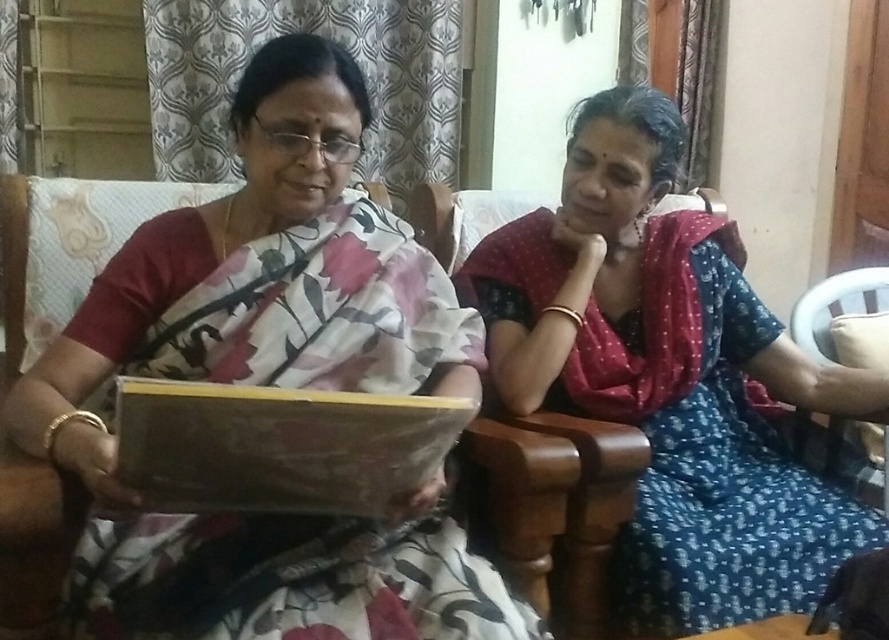
Question: Which point is closer to the camera taking this photo?

Choices:
 (A) (627, 353)
 (B) (223, 211)

Answer: (B)

Question: Can you confirm if floral silk saree at center is positioned below blue printed saree at center?

Choices:
 (A) no
 (B) yes

Answer: (A)

Question: Is floral silk saree at center positioned at the back of blue printed saree at center?

Choices:
 (A) no
 (B) yes

Answer: (A)

Question: Which object appears farthest from the camera in this image?

Choices:
 (A) blue printed saree at center
 (B) floral silk saree at center

Answer: (A)

Question: Does floral silk saree at center appear over blue printed saree at center?

Choices:
 (A) yes
 (B) no

Answer: (A)